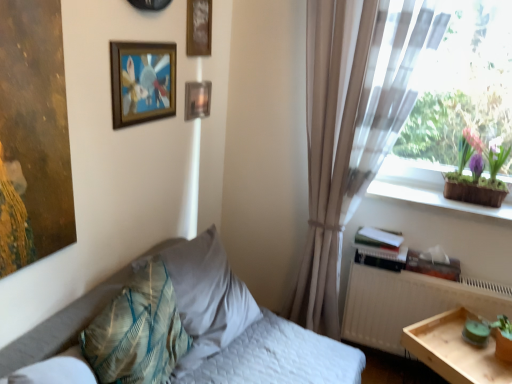
Where is `free spot above white matte radiator at right (from a real-world perspective)`? This screenshot has height=384, width=512. free spot above white matte radiator at right (from a real-world perspective) is located at coordinates (429, 268).